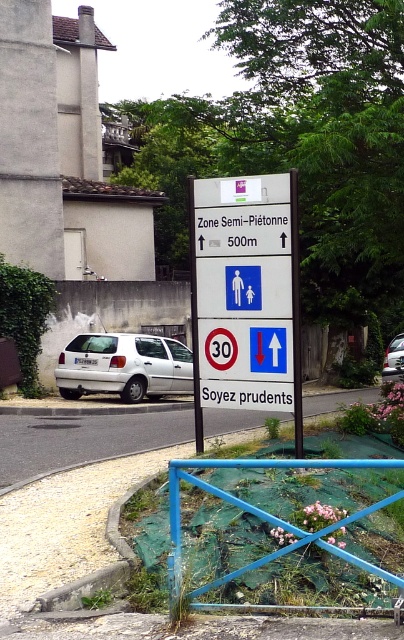
Does blue painted metal fence at lower center have a lesser width compared to metallic signpost at center?

In fact, blue painted metal fence at lower center might be wider than metallic signpost at center.

Between point (244, 465) and point (296, 388), which one is positioned behind?

Positioned behind is point (296, 388).

Between point (298, 529) and point (296, 451), which one is positioned behind?

Point (296, 451)

Image resolution: width=404 pixels, height=640 pixels. I want to click on blue painted metal fence at lower center, so click(x=265, y=515).

Is white plastic sign at upper center bigger than white matte car at center?

No.

Is white plastic sign at upper center thinner than white matte car at center?

Yes.

Image resolution: width=404 pixels, height=640 pixels. What do you see at coordinates (242, 230) in the screenshot? I see `white plastic sign at upper center` at bounding box center [242, 230].

What are the coordinates of `white plastic sign at upper center` in the screenshot? It's located at (242, 230).

Looking at this image, is white matte hatchback at center closer to the viewer compared to white plastic sign at upper center?

No, white matte hatchback at center is behind white plastic sign at upper center.

Is white matte hatchback at center below white plastic sign at upper center?

Indeed, white matte hatchback at center is positioned under white plastic sign at upper center.

The image size is (404, 640). Describe the element at coordinates (124, 365) in the screenshot. I see `white matte hatchback at center` at that location.

Image resolution: width=404 pixels, height=640 pixels. I want to click on white matte hatchback at center, so click(x=124, y=365).